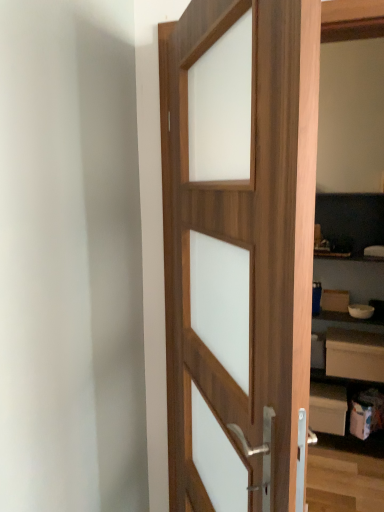
Question: Should I look upward or downward to see white matte drawer at lower right?

Choices:
 (A) up
 (B) down

Answer: (B)

Question: Is white matte bookshelf at right thinner than wooden door at center?

Choices:
 (A) yes
 (B) no

Answer: (B)

Question: Does white matte bookshelf at right contain wooden door at center?

Choices:
 (A) yes
 (B) no

Answer: (B)

Question: Is white matte bookshelf at right further to the viewer compared to wooden door at center?

Choices:
 (A) yes
 (B) no

Answer: (A)

Question: Is white matte bookshelf at right next to wooden door at center and touching it?

Choices:
 (A) no
 (B) yes

Answer: (A)

Question: From a real-world perspective, is white matte bookshelf at right over wooden door at center?

Choices:
 (A) no
 (B) yes

Answer: (A)

Question: Considering the relative sizes of white matte bookshelf at right and wooden door at center in the image provided, is white matte bookshelf at right bigger than wooden door at center?

Choices:
 (A) yes
 (B) no

Answer: (B)

Question: Can you confirm if wooden door at center is positioned to the left of white matte bookshelf at right?

Choices:
 (A) yes
 (B) no

Answer: (A)

Question: From the image's perspective, would you say wooden door at center is positioned over white matte bookshelf at right?

Choices:
 (A) no
 (B) yes

Answer: (B)

Question: Considering the relative sizes of wooden door at center and white matte bookshelf at right in the image provided, is wooden door at center thinner than white matte bookshelf at right?

Choices:
 (A) yes
 (B) no

Answer: (A)

Question: Considering the relative sizes of wooden door at center and white matte bookshelf at right in the image provided, is wooden door at center wider than white matte bookshelf at right?

Choices:
 (A) yes
 (B) no

Answer: (B)

Question: Is wooden door at center facing away from white matte bookshelf at right?

Choices:
 (A) no
 (B) yes

Answer: (B)

Question: Considering the relative sizes of wooden door at center and white matte bookshelf at right in the image provided, is wooden door at center smaller than white matte bookshelf at right?

Choices:
 (A) no
 (B) yes

Answer: (A)

Question: From a real-world perspective, is white matte drawer at lower right on top of white matte bookshelf at right?

Choices:
 (A) no
 (B) yes

Answer: (A)